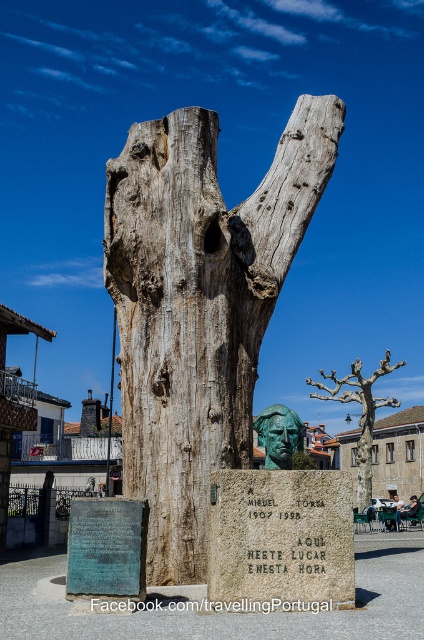
You are an art conservator standing at the base of the weathered wood tree trunk at center. You need to move a ladder to reach the top of the trunk. The ladder you have is 25 meters long. Is the ladder long enough to reach the top?

The ladder is 25 meters long, but the distance between you and the top of the weathered wood tree trunk at center is 28.70 meters. Therefore, the ladder is not long enough to reach the top.

You are standing at the monument and want to place a small flower offering. You have two points marked on your map as potential spots. The first is at point (181, 445) and the second at point (325, 397). Which point is closer to the front of the monument?

Point (181, 445) is in front of point (325, 397), so placing the flower there would be closer to the front of the monument.

You are an art student analyzing the monument. You observe the weathered wood tree trunk at center and the green patina bronze bust at center. Which object is positioned closer to the front of the monument?

The weathered wood tree trunk at center is positioned closer to the front of the monument than the green patina bronze bust at center, which is located behind it.